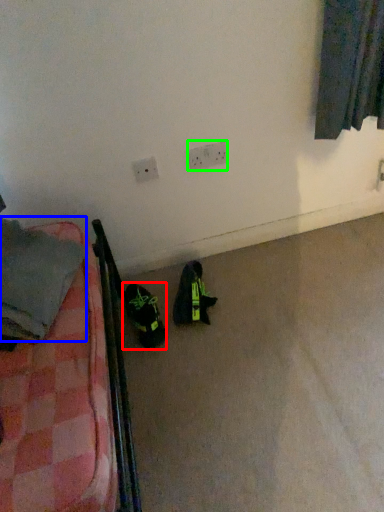
Question: Considering the real-world distances, which object is farthest from footwear (highlighted by a red box)? clothing (highlighted by a blue box) or electric outlet (highlighted by a green box)?

Choices:
 (A) clothing
 (B) electric outlet

Answer: (B)